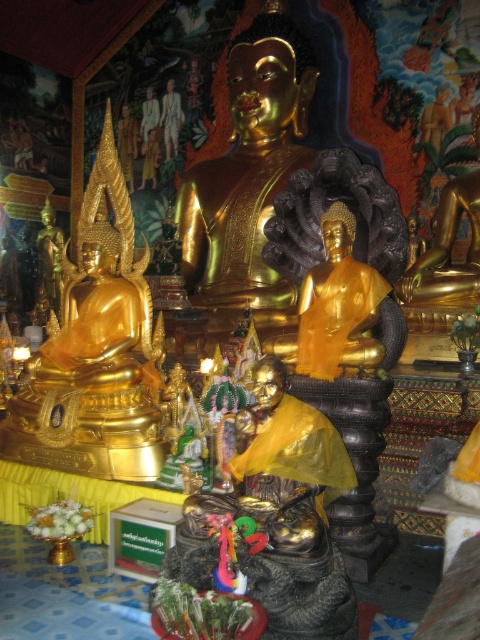
Can you confirm if gold polished statue at left is positioned above gold/yellow fabric draped statue at center?

Correct, gold polished statue at left is located above gold/yellow fabric draped statue at center.

Locate an element on the screen. This screenshot has width=480, height=640. gold polished statue at left is located at coordinates (95, 352).

This screenshot has height=640, width=480. What are the coordinates of `gold polished statue at left` in the screenshot? It's located at (95, 352).

Between gold shiny statue at center and gold polished statue at right, which one is positioned higher?

gold polished statue at right

Consider the image. Who is more forward, (343, 333) or (423, 266)?

Point (343, 333) is more forward.

Where is `gold shiny statue at center`? gold shiny statue at center is located at coordinates (338, 305).

Does gold/yellow fabric draped statue at center appear under gold shiny statue at center?

Correct, gold/yellow fabric draped statue at center is located below gold shiny statue at center.

Who is more forward, [287,595] or [384,296]?

Point [287,595]

Find the location of a particular element. The height and width of the screenshot is (640, 480). gold/yellow fabric draped statue at center is located at coordinates (275, 516).